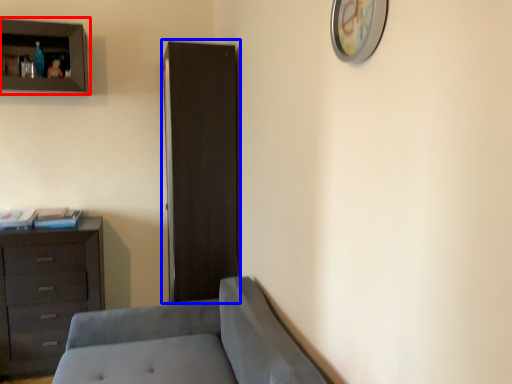
Question: Which object appears closest to the camera in this image, cupboard (highlighted by a red box) or file cabinet (highlighted by a blue box)?

Choices:
 (A) cupboard
 (B) file cabinet

Answer: (B)